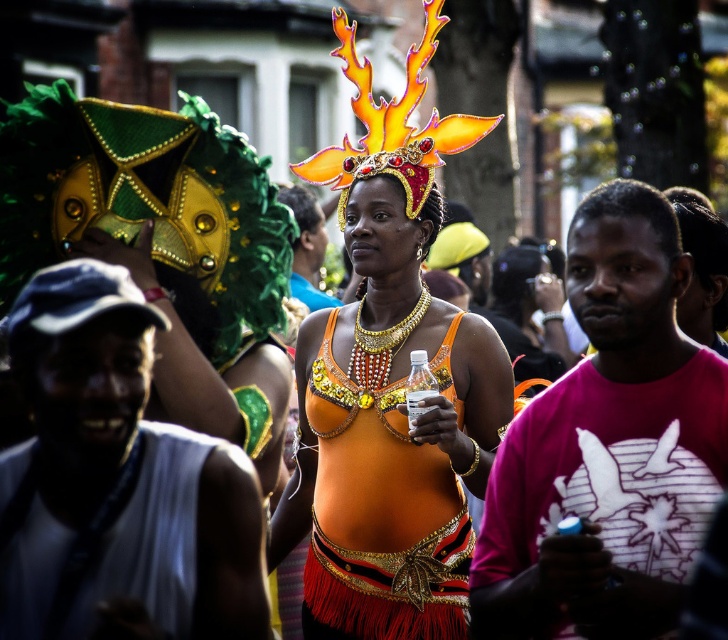
Question: Which object appears farthest from the camera in this image?

Choices:
 (A) white fabric shirt at center
 (B) orange fabric dress at center
 (C) pink fabric shirt at right

Answer: (B)

Question: Observing the image, what is the correct spatial positioning of orange sequined top at center in reference to white fabric shirt at center?

Choices:
 (A) above
 (B) below

Answer: (A)

Question: Is orange sequined top at center thinner than white fabric shirt at center?

Choices:
 (A) no
 (B) yes

Answer: (A)

Question: Estimate the real-world distances between objects in this image. Which object is farther from the pink fabric shirt at right?

Choices:
 (A) white fabric shirt at center
 (B) orange fabric dress at center

Answer: (A)

Question: Which point is farther to the camera?

Choices:
 (A) click(408, 509)
 (B) click(357, 269)
 (C) click(513, 508)
 (D) click(95, 596)

Answer: (B)

Question: Is orange sequined top at center closer to camera compared to white fabric shirt at center?

Choices:
 (A) no
 (B) yes

Answer: (A)